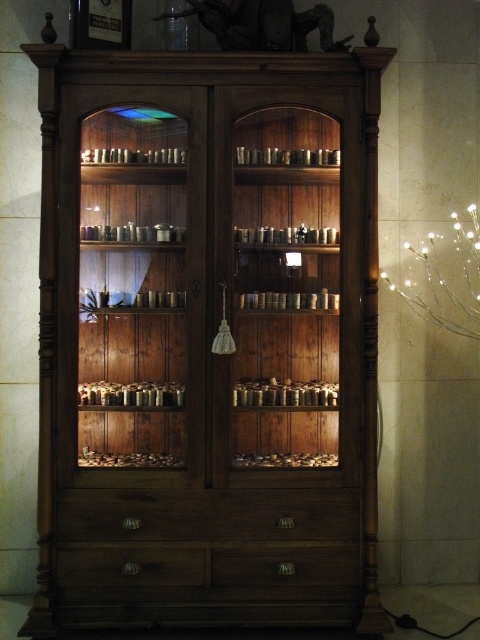
Does wooden shelves at left have a greater width compared to matte wood drawer at center?

No.

Who is more distant from viewer, (155, 198) or (287, 563)?

The point (155, 198) is behind.

Is point (122, 296) positioned behind point (330, 554)?

Yes, it is behind point (330, 554).

Where is `wooden shelves at left`? wooden shelves at left is located at coordinates (135, 285).

Is point (226, 573) behind point (165, 6)?

No, it is not.

Is matte wood drawer at center below transparent glass jar at upper center?

Indeed, matte wood drawer at center is positioned under transparent glass jar at upper center.

Who is more distant from viewer, (294, 554) or (179, 22)?

The point (179, 22) is more distant.

You are a GUI agent. You are given a task and a screenshot of the screen. Output one action in this format:
    pyautogui.click(x=<x>, y=<y>)
    Task: Click on the matte wood drawer at center
    The image size is (480, 640).
    Given the screenshot: What is the action you would take?
    (x=283, y=564)

Does matte wood drawer at lower center appear over transparent glass jar at upper center?

Actually, matte wood drawer at lower center is below transparent glass jar at upper center.

You are a GUI agent. You are given a task and a screenshot of the screen. Output one action in this format:
    pyautogui.click(x=<x>, y=<y>)
    Task: Click on the matte wood drawer at lower center
    Image resolution: width=480 pixels, height=640 pixels.
    Given the screenshot: What is the action you would take?
    pyautogui.click(x=132, y=564)

Locate an element on the screen. matte wood drawer at lower center is located at coordinates (132, 564).